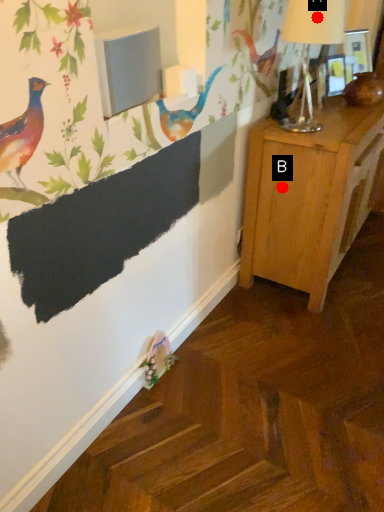
Question: Two points are circled on the image, labeled by A and B beside each circle. Which point appears farthest from the camera in this image?

Choices:
 (A) A is further
 (B) B is further

Answer: (B)